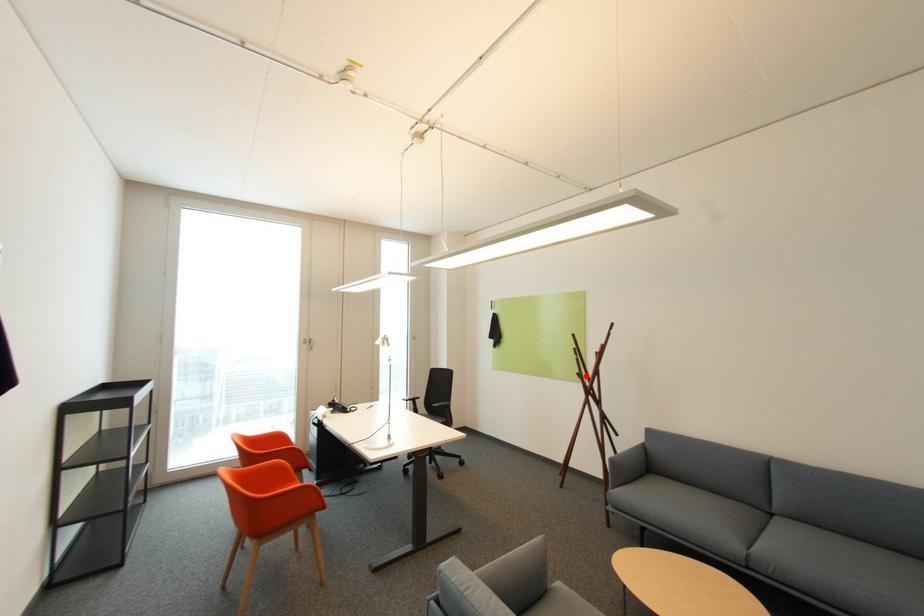
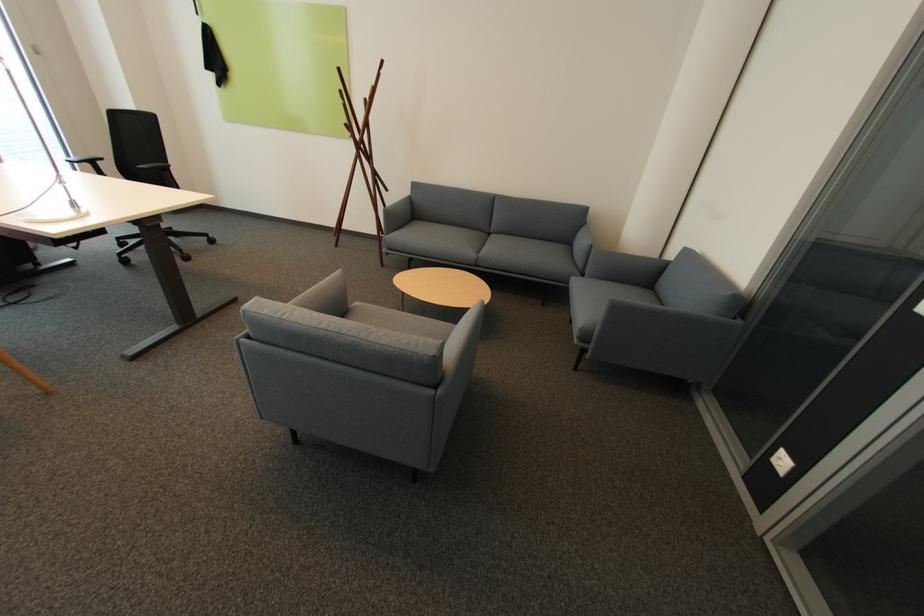
Question: I am providing you with two images of the same scene from different viewpoints. A red point is marked on the first image. Can you still see the location of the red point in image 2?

Choices:
 (A) Yes
 (B) No

Answer: (A)